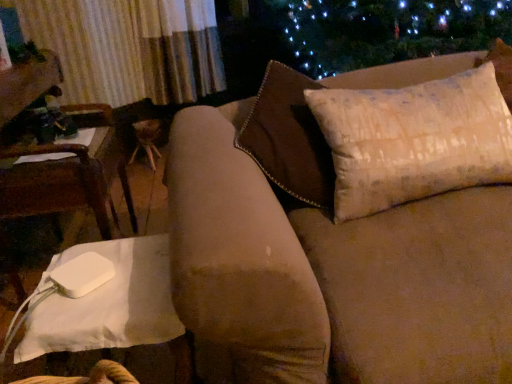
In order to face white fabric chair at left, should I rotate leftwards or rightwards?

Rotate your view left by about 23.277°.

At what (x,y) coordinates should I click in order to perform the action: click on suede-like brown couch at upper right. Please return your answer as a coordinate pair (x, y). The height and width of the screenshot is (384, 512). Looking at the image, I should click on (250, 233).

This screenshot has height=384, width=512. Describe the element at coordinates (414, 140) in the screenshot. I see `beige textured pillow at upper right` at that location.

You are a GUI agent. You are given a task and a screenshot of the screen. Output one action in this format:
    pyautogui.click(x=<x>, y=<y>)
    Task: Click on the white fabric table at lower left
    The width and height of the screenshot is (512, 384).
    Given the screenshot: What is the action you would take?
    pyautogui.click(x=182, y=361)

Find the location of a particular element. This screenshot has height=384, width=512. white fabric chair at left is located at coordinates (56, 185).

Can you confirm if beige textured pillow at upper right is thinner than white fabric chair at left?

Correct, the width of beige textured pillow at upper right is less than that of white fabric chair at left.

Is beige textured pillow at upper right not inside white fabric chair at left?

Absolutely, beige textured pillow at upper right is external to white fabric chair at left.

Does beige textured pillow at upper right touch white fabric chair at left?

No, beige textured pillow at upper right is not touching white fabric chair at left.

Where is `table lying below the suede-like brown couch at upper right (from the image's perspective)`? This screenshot has width=512, height=384. table lying below the suede-like brown couch at upper right (from the image's perspective) is located at coordinates pyautogui.click(x=182, y=361).

Is suede-like brown couch at upper right turned away from white fabric table at lower left?

That's not correct — suede-like brown couch at upper right is not looking away from white fabric table at lower left.

Considering the relative sizes of suede-like brown couch at upper right and white fabric table at lower left in the image provided, is suede-like brown couch at upper right smaller than white fabric table at lower left?

No.

Is point (490, 52) positioned after point (15, 274)?

No.

From the image's perspective, is suede-like brown couch at upper right on white fabric chair at left?

No, from the image's perspective, suede-like brown couch at upper right is not on top of white fabric chair at left.

Between point (281, 70) and point (4, 177), which one is positioned in front?

Positioned in front is point (281, 70).

How distant is suede-like brown couch at upper right from white fabric chair at left?

A distance of 23.27 inches exists between suede-like brown couch at upper right and white fabric chair at left.

Who is bigger, suede-like brown couch at upper right or white fabric chair at left?

Bigger between the two is suede-like brown couch at upper right.

Is white fabric table at lower left positioned with its back to suede-like brown couch at upper right?

No, white fabric table at lower left is not facing away from suede-like brown couch at upper right.

Is white fabric table at lower left positioned far away from suede-like brown couch at upper right?

white fabric table at lower left is near suede-like brown couch at upper right, not far away.

Is white fabric table at lower left closer to the viewer compared to suede-like brown couch at upper right?

That is False.

What's the angular difference between beige textured pillow at upper right and white fabric table at lower left's facing directions?

The angular difference between beige textured pillow at upper right and white fabric table at lower left is 1.09 degrees.

Does beige textured pillow at upper right have a lesser height compared to white fabric table at lower left?

Indeed, beige textured pillow at upper right has a lesser height compared to white fabric table at lower left.

Is beige textured pillow at upper right not close to white fabric table at lower left?

That's not correct — beige textured pillow at upper right is a little close to white fabric table at lower left.

Locate an element on the screen. The width and height of the screenshot is (512, 384). table located on the left of beige textured pillow at upper right is located at coordinates (182, 361).

Is white fabric table at lower left behind white fabric chair at left?

No, white fabric table at lower left is closer to the camera.

Is point (17, 278) less distant than point (38, 171)?

No.

Can white fabric chair at left be found inside white fabric table at lower left?

Actually, white fabric chair at left is outside white fabric table at lower left.

Which of these two, white fabric table at lower left or white fabric chair at left, stands taller?

Standing taller between the two is white fabric chair at left.

Does point (496, 64) lie behind point (364, 184)?

Yes.

Are suede-like brown couch at upper right and beige textured pillow at upper right far apart?

No, suede-like brown couch at upper right is not far from beige textured pillow at upper right.

Between suede-like brown couch at upper right and beige textured pillow at upper right, which one has less height?

beige textured pillow at upper right is shorter.

Is suede-like brown couch at upper right in front of or behind beige textured pillow at upper right in the image?

Clearly, suede-like brown couch at upper right is in front of beige textured pillow at upper right.

The width and height of the screenshot is (512, 384). I want to click on pillow that appears above the white fabric chair at left (from a real-world perspective), so click(x=414, y=140).

Identify the location of table behind the suede-like brown couch at upper right. This screenshot has height=384, width=512. (182, 361).

Based on their spatial positions, is suede-like brown couch at upper right or white fabric chair at left closer to white fabric table at lower left?

Among the two, suede-like brown couch at upper right is located nearer to white fabric table at lower left.

Looking at the image, which one is located further to suede-like brown couch at upper right, white fabric table at lower left or white fabric chair at left?

white fabric chair at left is further to suede-like brown couch at upper right.

Looking at the image, which one is located further to white fabric chair at left, white fabric table at lower left or suede-like brown couch at upper right?

white fabric table at lower left is positioned further to the anchor white fabric chair at left.

Estimate the real-world distances between objects in this image. Which object is further from white fabric table at lower left, beige textured pillow at upper right or suede-like brown couch at upper right?

beige textured pillow at upper right.

Looking at the image, which one is located further to beige textured pillow at upper right, white fabric chair at left or suede-like brown couch at upper right?

white fabric chair at left is positioned further to the anchor beige textured pillow at upper right.

Estimate the real-world distances between objects in this image. Which object is further from beige textured pillow at upper right, white fabric chair at left or white fabric table at lower left?

white fabric chair at left lies further to beige textured pillow at upper right than the other object.

From the image, which object appears to be nearer to white fabric table at lower left, beige textured pillow at upper right or white fabric chair at left?

beige textured pillow at upper right is positioned closer to the anchor white fabric table at lower left.

When comparing their distances from white fabric chair at left, does white fabric table at lower left or beige textured pillow at upper right seem closer?

The object closer to white fabric chair at left is white fabric table at lower left.

Image resolution: width=512 pixels, height=384 pixels. Find the location of `pillow located between white fabric table at lower left and suede-like brown couch at upper right in the left-right direction`. pillow located between white fabric table at lower left and suede-like brown couch at upper right in the left-right direction is located at coordinates (414, 140).

The height and width of the screenshot is (384, 512). I want to click on pillow between white fabric chair at left and suede-like brown couch at upper right, so click(x=414, y=140).

The height and width of the screenshot is (384, 512). What are the coordinates of `table between white fabric chair at left and suede-like brown couch at upper right in the horizontal direction` in the screenshot? It's located at (x=182, y=361).

Locate an element on the screen. The width and height of the screenshot is (512, 384). table situated between white fabric chair at left and beige textured pillow at upper right from left to right is located at coordinates (182, 361).